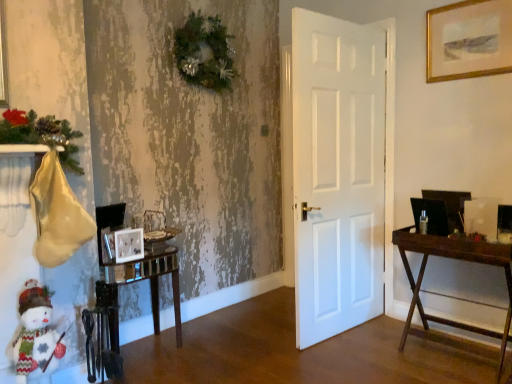
Question: Is point (441, 38) positioned closer to the camera than point (222, 82)?

Choices:
 (A) farther
 (B) closer

Answer: (B)

Question: From the image's perspective, relative to green textured wreath at upper center, is gold-framed artwork at upper right, the 3th picture frame from the left, above or below?

Choices:
 (A) above
 (B) below

Answer: (B)

Question: Which object is positioned closest to the wooden desk at right?

Choices:
 (A) clear glass table at lower left
 (B) green textured wreath at upper center
 (C) matte silver picture frame at lower left, which appears as the 1th picture frame when viewed from the left
 (D) matte white picture frame at lower left, placed as the 2th picture frame when sorted from left to right
 (E) gold-framed artwork at upper right, the 3th picture frame from the left

Answer: (E)

Question: Which object is the closest to the clear glass table at lower left?

Choices:
 (A) matte white picture frame at lower left, placed as the 2th picture frame when sorted from left to right
 (B) gold-framed artwork at upper right, which is counted as the 3th picture frame, starting from the bottom
 (C) matte silver picture frame at lower left, which appears as the 1th picture frame when viewed from the left
 (D) knitted fabric snowman at lower left
 (E) green textured wreath at upper center

Answer: (A)